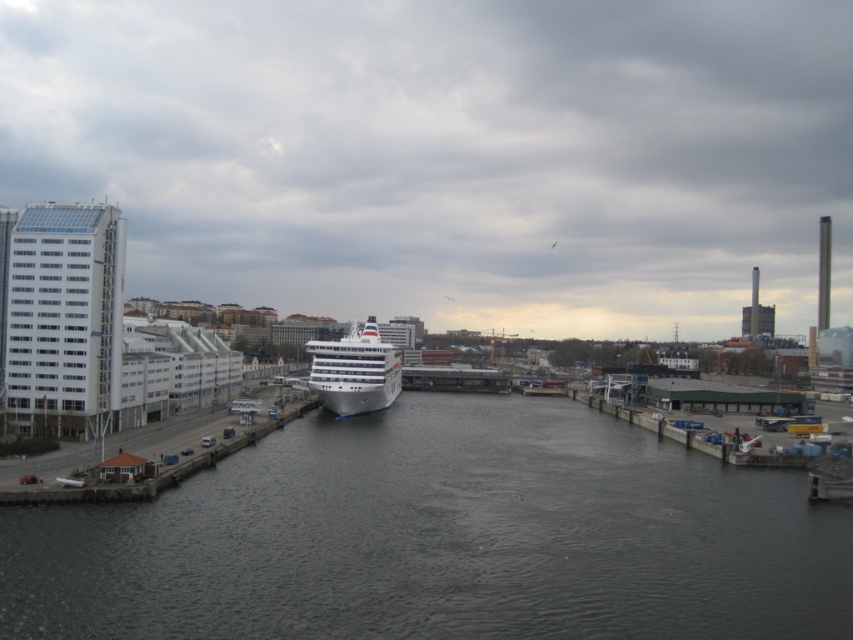
Question: Which object appears farthest from the camera in this image?

Choices:
 (A) white glossy cruise ship at center
 (B) dark gray water at center

Answer: (A)

Question: Does dark gray water at center come in front of white glossy cruise ship at center?

Choices:
 (A) yes
 (B) no

Answer: (A)

Question: Observing the image, what is the correct spatial positioning of dark gray water at center in reference to white glossy cruise ship at center?

Choices:
 (A) right
 (B) left

Answer: (A)

Question: Among these objects, which one is farthest from the camera?

Choices:
 (A) dark gray water at center
 (B) white glossy cruise ship at center

Answer: (B)

Question: Does dark gray water at center appear over white glossy cruise ship at center?

Choices:
 (A) no
 (B) yes

Answer: (A)

Question: Which of the following is the closest to the observer?

Choices:
 (A) white glossy cruise ship at center
 (B) dark gray water at center

Answer: (B)